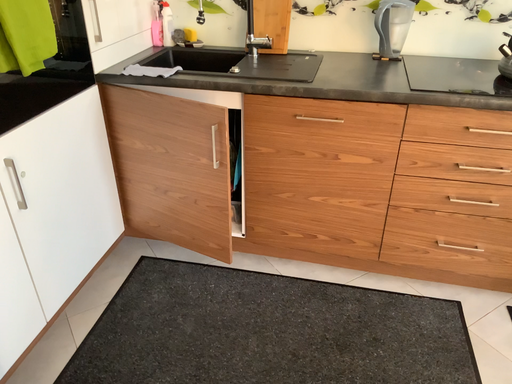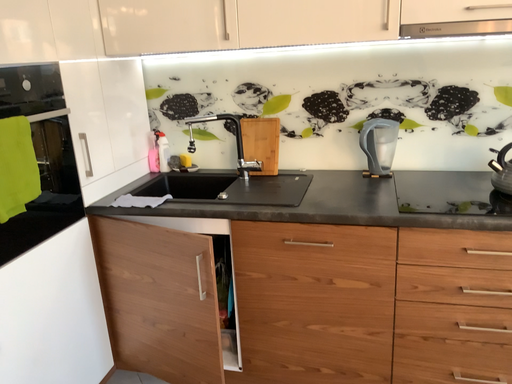
Question: How did the camera likely rotate when shooting the video?

Choices:
 (A) rotated upward
 (B) rotated downward

Answer: (A)